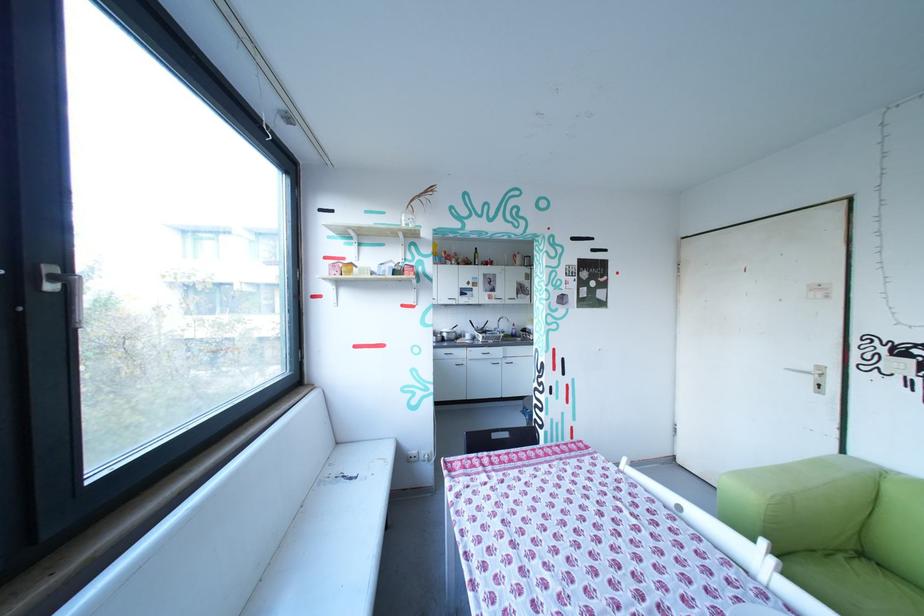
The width and height of the screenshot is (924, 616). What are the coordinates of `silver door handle` in the screenshot? It's located at (66, 291).